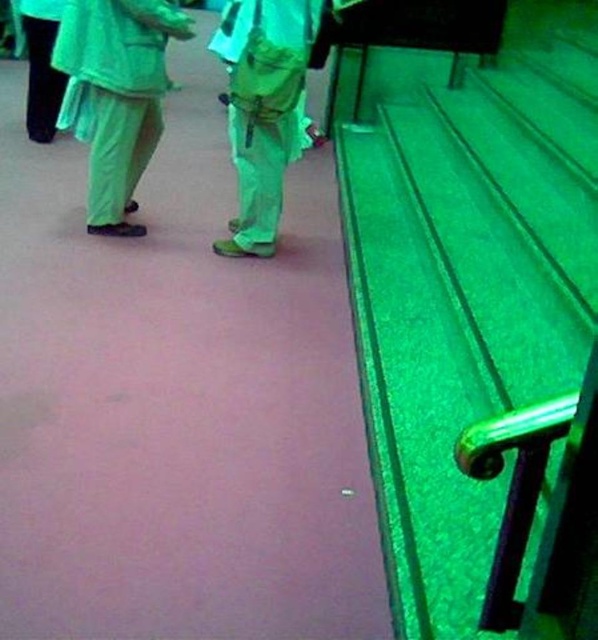
You are a fashion designer analyzing the image. You need to determine which pair of pants has a wider leg opening between the matte green pants at center and the black matte pants at left. Which one is wider?

The matte green pants at center has a wider leg opening than the black matte pants at left since the matte green pants at center is wider.

You are a fashion designer observing the scene. You notice two pairs of pants in the image. The first is matte green pants at center and the second is black matte pants at left. Which pair of pants is taller?

The matte green pants at center is taller than black matte pants at left.

You are standing at the origin point in the image. Where is the green fabric pants at left located in terms of coordinates?

The green fabric pants at left is located at coordinates point (115, 96).